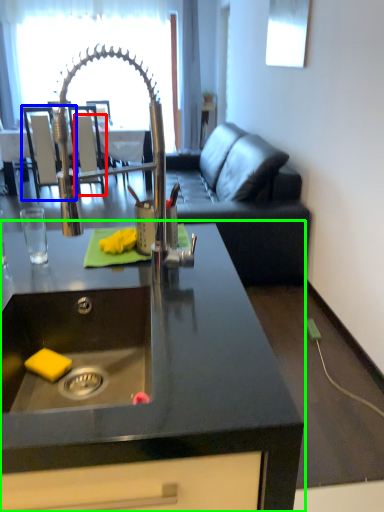
Question: Which is farther away from armchair (highlighted by a red box)? armchair (highlighted by a blue box) or countertop (highlighted by a green box)?

Choices:
 (A) armchair
 (B) countertop

Answer: (B)